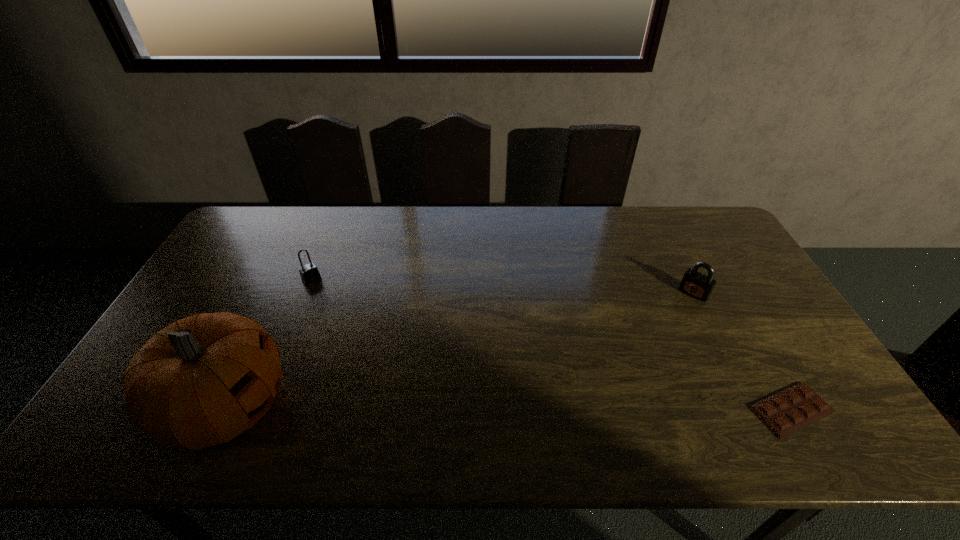
Locate an element on the screen. pumpkin is located at coordinates (203, 380).

At what (x,y) coordinates should I click in order to perform the action: click on the shortest object. Please return your answer as a coordinate pair (x, y). Looking at the image, I should click on (786, 412).

In order to click on the right padlock in this screenshot , I will do `click(697, 285)`.

The width and height of the screenshot is (960, 540). Find the location of `the left padlock`. the left padlock is located at coordinates (309, 273).

At what (x,y) coordinates should I click in order to perform the action: click on vacant region located 0.260m on the front-facing side of the pumpkin. Please return your answer as a coordinate pair (x, y). This screenshot has width=960, height=540. Looking at the image, I should click on (398, 407).

Locate an element on the screen. free space located on the back of the chocolate bar is located at coordinates (719, 284).

This screenshot has height=540, width=960. What are the coordinates of `vacant region located 0.160m on the front of the right padlock near the keyhole` in the screenshot? It's located at (661, 329).

Find the location of a particular element. free spot located 0.340m on the front of the right padlock near the keyhole is located at coordinates (628, 367).

Where is `vacant space located on the front of the right padlock near the keyhole`? This screenshot has height=540, width=960. vacant space located on the front of the right padlock near the keyhole is located at coordinates (680, 308).

Where is `free point located 0.070m on the shackle of the left padlock`? free point located 0.070m on the shackle of the left padlock is located at coordinates (326, 295).